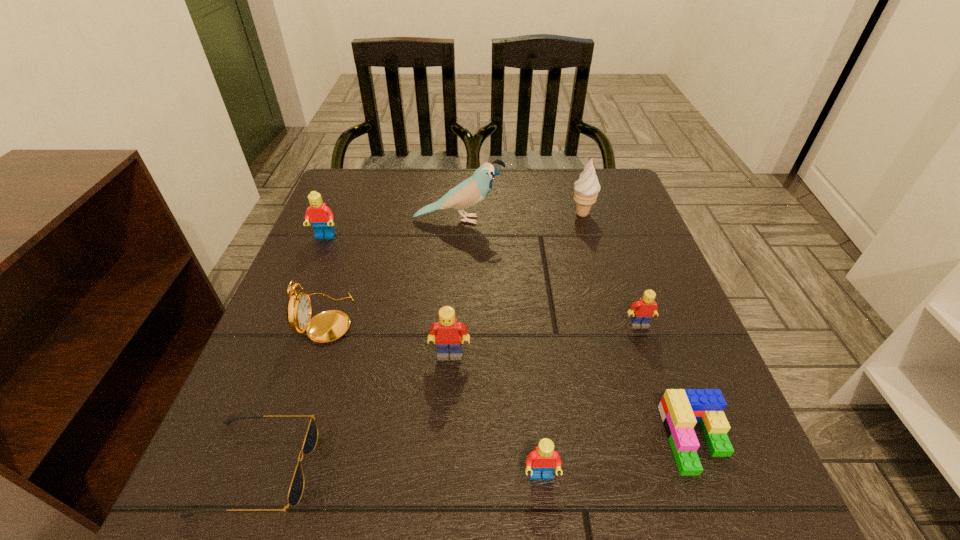
You are a GUI agent. You are given a task and a screenshot of the screen. Output one action in this format:
    pyautogui.click(x=<x>, y=<y>)
    Task: Click on the object positioned at the near right corner
    This screenshot has height=540, width=960.
    Given the screenshot: What is the action you would take?
    pyautogui.click(x=680, y=409)

Find the location of a particular element. The width and height of the screenshot is (960, 540). vacant space at the far edge of the desktop is located at coordinates (562, 170).

Where is `vacant space at the near edge`? This screenshot has width=960, height=540. vacant space at the near edge is located at coordinates point(440,512).

Find the location of a particular element. The height and width of the screenshot is (540, 960). free region at the left edge is located at coordinates (352, 341).

The image size is (960, 540). Find the location of `free space at the right edge of the desktop`. free space at the right edge of the desktop is located at coordinates (650, 252).

Find the location of a particular element. vacant space at the far left corner of the desktop is located at coordinates (345, 168).

Locate an element on the screen. vacant space at the near left corner is located at coordinates (302, 525).

Where is `vacant space at the far right corner of the desktop`? The height and width of the screenshot is (540, 960). vacant space at the far right corner of the desktop is located at coordinates (611, 204).

The height and width of the screenshot is (540, 960). I want to click on free region at the near right corner of the desktop, so click(731, 477).

What are the coordinates of `vacant area that lies between the third farthest object and the second Lego from left to right` in the screenshot? It's located at (388, 296).